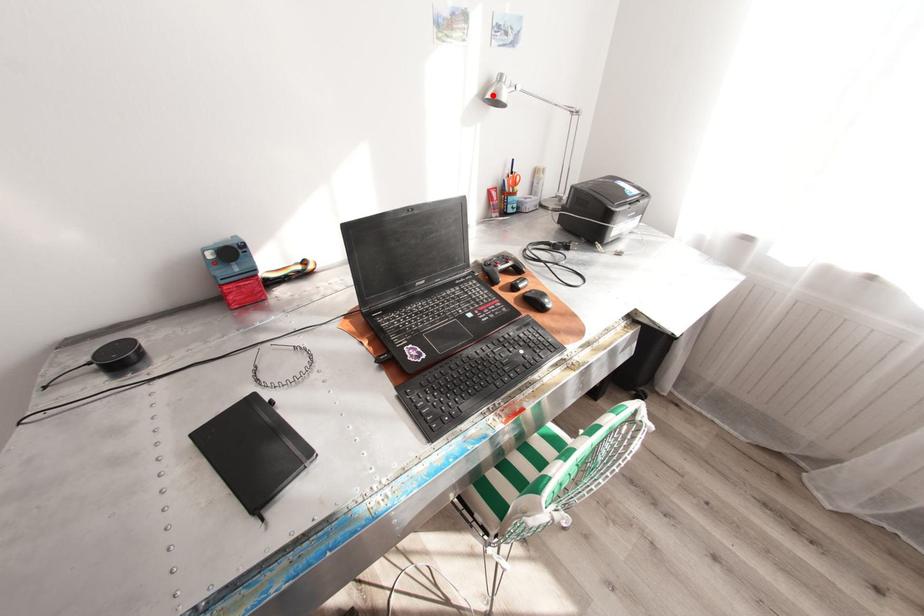
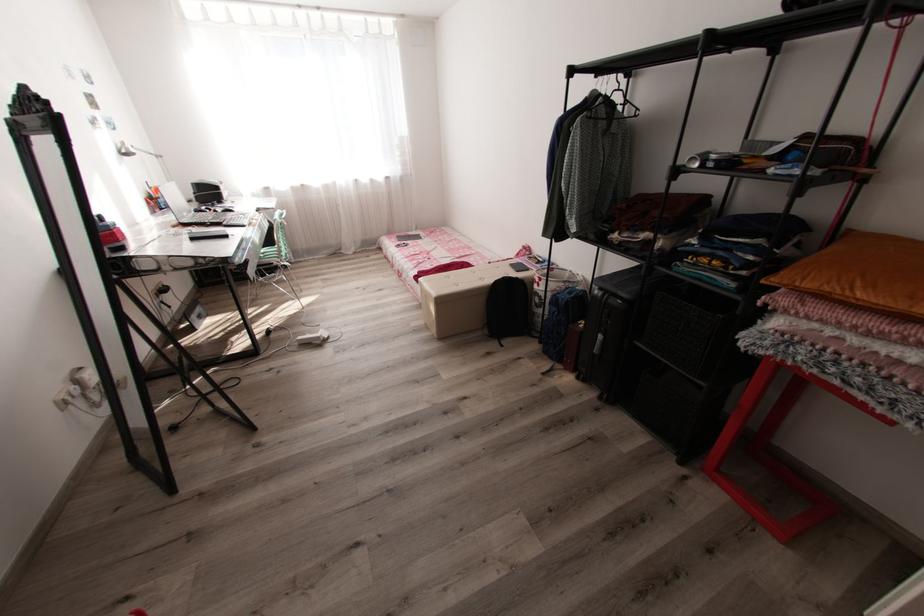
Question: I am providing you with two images of the same scene from different viewpoints. Given a red point in image1, look at the same physical point in image2. Is it:

Choices:
 (A) Closer to the viewpoint
 (B) Farther from the viewpoint

Answer: (B)